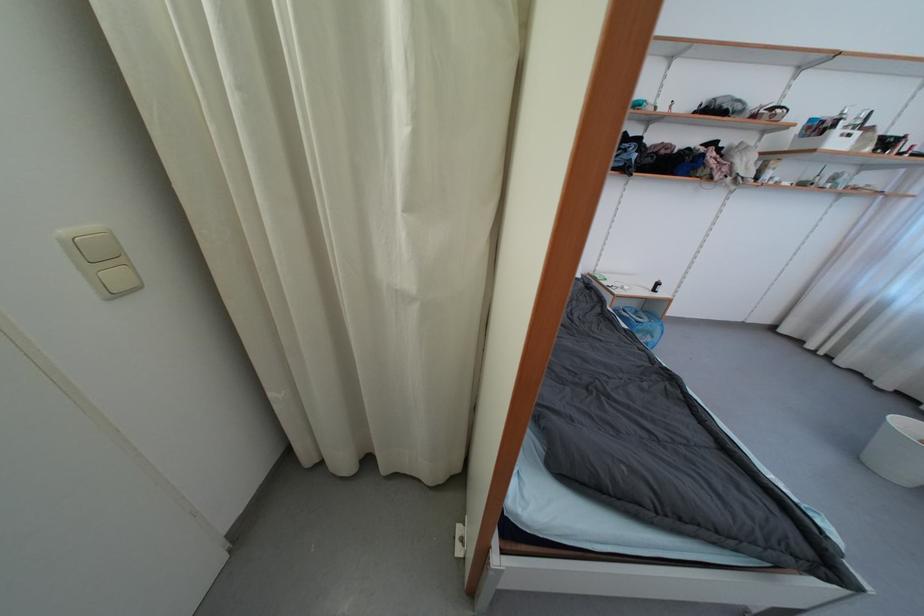
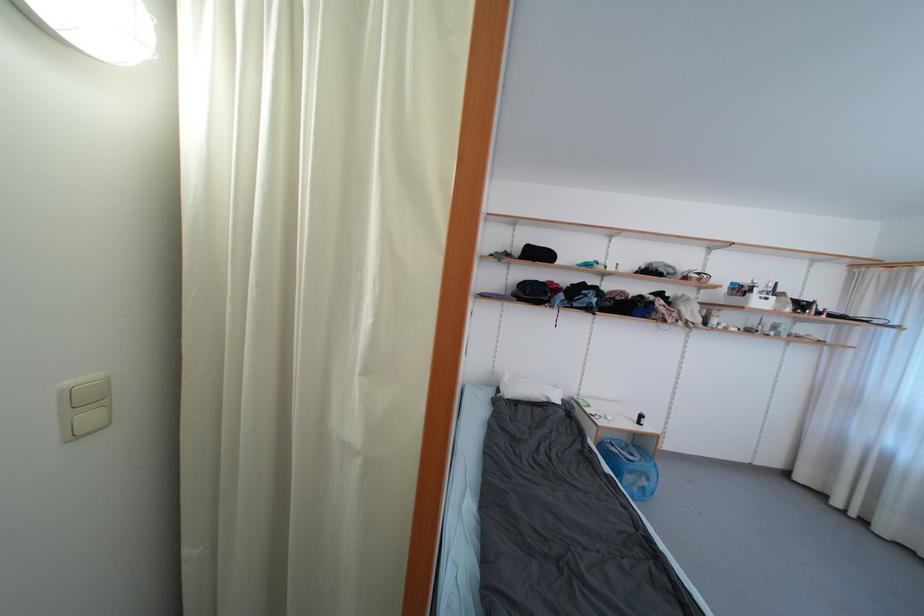
Question: How did the camera likely rotate?

Choices:
 (A) Left
 (B) Right
 (C) Up
 (D) Down

Answer: (C)